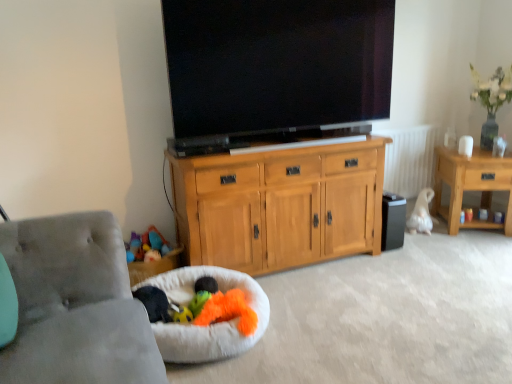
Question: Is light wood cabinet at center at the back of white fluffy dog bed at lower left?

Choices:
 (A) yes
 (B) no

Answer: (B)

Question: Considering the relative sizes of white fluffy dog bed at lower left and light wood cabinet at center in the image provided, is white fluffy dog bed at lower left smaller than light wood cabinet at center?

Choices:
 (A) yes
 (B) no

Answer: (A)

Question: From the image's perspective, would you say white fluffy dog bed at lower left is shown under light wood cabinet at center?

Choices:
 (A) yes
 (B) no

Answer: (A)

Question: Are white fluffy dog bed at lower left and light wood cabinet at center making contact?

Choices:
 (A) no
 (B) yes

Answer: (A)

Question: Is white fluffy dog bed at lower left further to the viewer compared to light wood cabinet at center?

Choices:
 (A) yes
 (B) no

Answer: (B)

Question: Is smooth plastic cup at right, marked as the 3th toy in a bottom-to-top arrangement, spatially inside black glossy flat-screen tv at center, or outside of it?

Choices:
 (A) outside
 (B) inside

Answer: (A)

Question: Relative to black glossy flat-screen tv at center, is smooth plastic cup at right, the 3th toy when ordered from front to back, in front or behind?

Choices:
 (A) behind
 (B) front

Answer: (A)

Question: Is smooth plastic cup at right, positioned as the first toy in top-to-bottom order, taller or shorter than black glossy flat-screen tv at center?

Choices:
 (A) short
 (B) tall

Answer: (A)

Question: From a real-world perspective, is smooth plastic cup at right, marked as the 3th toy in a bottom-to-top arrangement, positioned above or below black glossy flat-screen tv at center?

Choices:
 (A) below
 (B) above

Answer: (A)

Question: Is wooden side table at right taller or shorter than soft plush toy at lower center, marked as the 3th toy in a top-to-bottom arrangement?

Choices:
 (A) tall
 (B) short

Answer: (A)

Question: Do you think wooden side table at right is within soft plush toy at lower center, which is the third toy from right to left, or outside of it?

Choices:
 (A) outside
 (B) inside

Answer: (A)

Question: Is point (487, 195) closer or farther from the camera than point (180, 316)?

Choices:
 (A) farther
 (B) closer

Answer: (A)

Question: Is wooden side table at right wider or thinner than soft plush toy at lower center, acting as the 1th toy starting from the left?

Choices:
 (A) thin
 (B) wide

Answer: (B)

Question: Is smooth plastic cup at right, the 3th toy when ordered from front to back, wider or thinner than white fluffy dog bed at lower left?

Choices:
 (A) wide
 (B) thin

Answer: (B)

Question: In the image, is smooth plastic cup at right, marked as the first toy in a back-to-front arrangement, on the left side or the right side of white fluffy dog bed at lower left?

Choices:
 (A) right
 (B) left

Answer: (A)